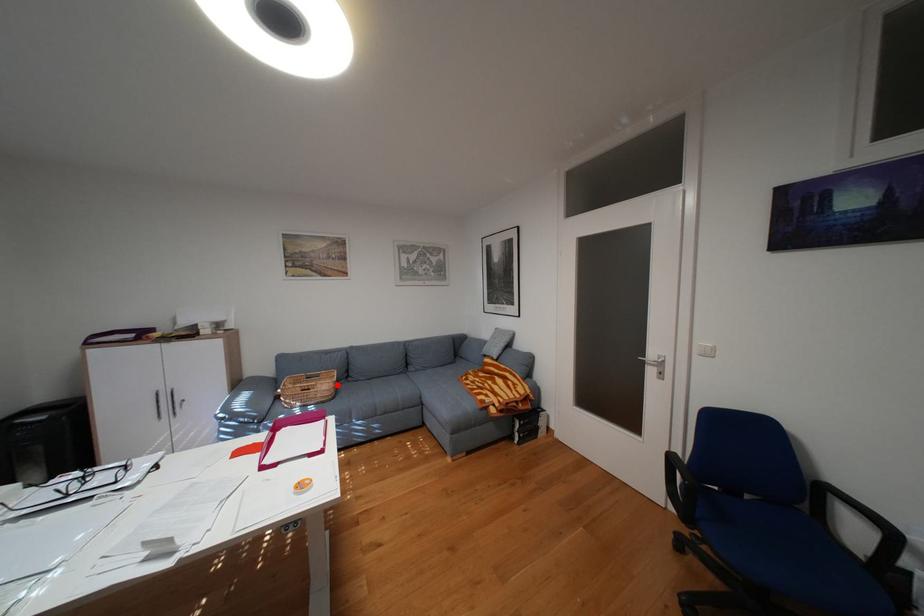
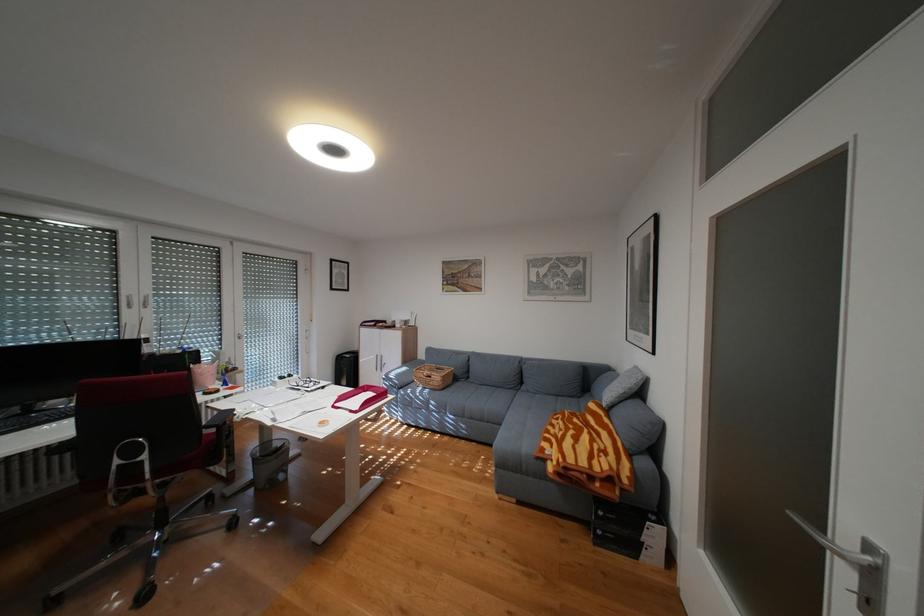
Question: I am providing you with two images of the same scene from different viewpoints. A red point is marked on the first image. Is the red point's position out of view in image 2?

Choices:
 (A) Yes
 (B) No

Answer: (B)